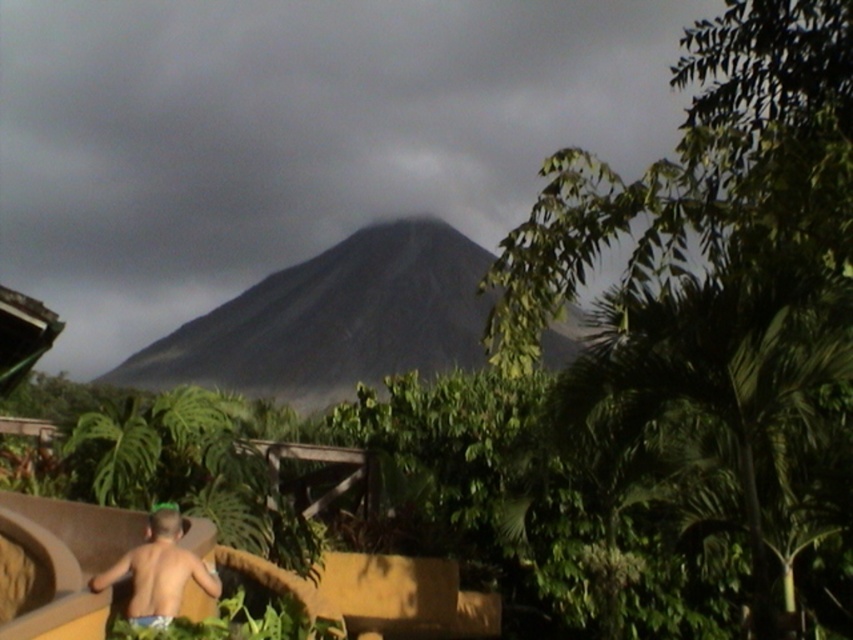
You are a visitor at the tropical viewing platform. You see the dark gray volcanic rock at center and the light blue fabric at lower left. Which object is wider?

The dark gray volcanic rock at center is wider than the light blue fabric at lower left.

Based on the photo, you are standing at the viewing platform and want to take a photo of the dark gray volcanic rock at center. If the camera is set to focus at coordinate point 0.500, 0.393, will it capture the rock clearly?

Yes, the dark gray volcanic rock at center is exactly at point (334, 320), so the camera will capture it clearly.

You are standing on the wooden railing mentioned in the scene. You want to place a small potted plant on either the dark gray volcanic rock at center or the light blue fabric at lower left. Which surface is higher and thus better for visibility?

The dark gray volcanic rock at center is located above the light blue fabric at lower left, so placing the potted plant on the dark gray volcanic rock at center would provide better visibility.